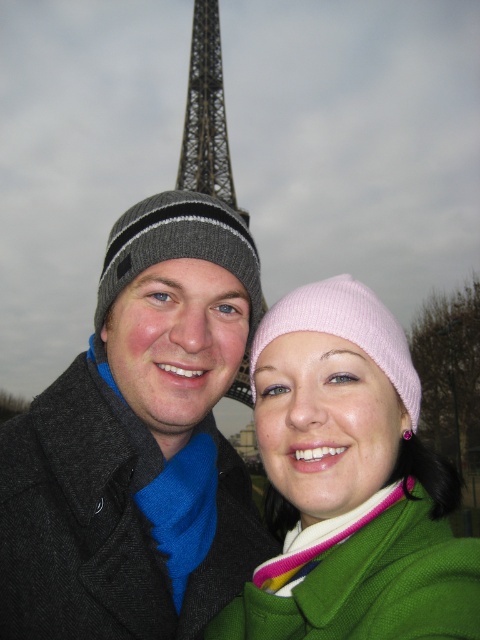
Who is shorter, pink knit beanie at center or metallic lattice structure at center?

pink knit beanie at center is shorter.

Which is behind, point (343, 486) or point (205, 168)?

The point (205, 168) is more distant.

Find the location of a particular element. pink knit beanie at center is located at coordinates (349, 483).

Where is `pink knit beanie at center`? This screenshot has height=640, width=480. pink knit beanie at center is located at coordinates (349, 483).

Does pink knit beanie at center have a greater height compared to gray knit beanie at left?

Yes.

Who is positioned more to the left, pink knit beanie at center or gray knit beanie at left?

gray knit beanie at left is more to the left.

Who is more distant from viewer, (x=357, y=397) or (x=236, y=388)?

The point (x=357, y=397) is behind.

You are a GUI agent. You are given a task and a screenshot of the screen. Output one action in this format:
    pyautogui.click(x=<x>, y=<y>)
    Task: Click on the pink knit beanie at center
    The height and width of the screenshot is (640, 480).
    Given the screenshot: What is the action you would take?
    (x=349, y=483)

Which of these two, pink knit beanie at center or metallic lattice structure at upper center, stands taller?

Standing taller between the two is pink knit beanie at center.

The height and width of the screenshot is (640, 480). Describe the element at coordinates (349, 483) in the screenshot. I see `pink knit beanie at center` at that location.

Where is `pink knit beanie at center`? pink knit beanie at center is located at coordinates (349, 483).